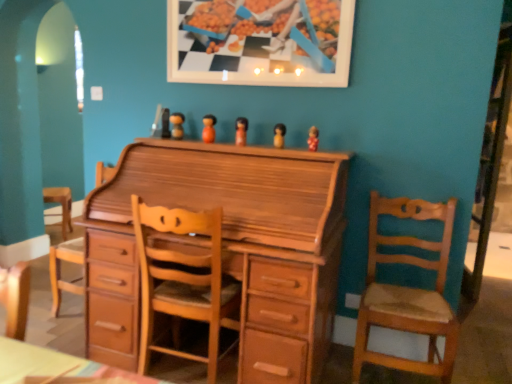
This screenshot has height=384, width=512. Find the location of `vacant region in front of matte wooden figurine at center, marked as the 1th toy in a right-to-left arrangement`. vacant region in front of matte wooden figurine at center, marked as the 1th toy in a right-to-left arrangement is located at coordinates (313, 156).